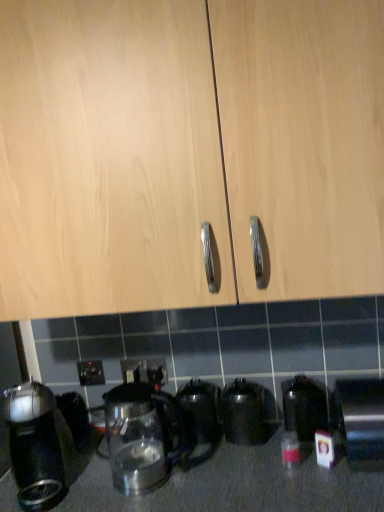
Question: Is point (84, 362) positioned closer to the camera than point (44, 385)?

Choices:
 (A) closer
 (B) farther

Answer: (A)

Question: In terms of width, does black plastic electric outlet at lower center, the third electric outlet viewed from the right, look wider or thinner when compared to black plastic coffee maker at left, acting as the 6th kitchen appliance starting from the right?

Choices:
 (A) wide
 (B) thin

Answer: (B)

Question: Which object is positioned closest to the translucent glass bottle at lower right?

Choices:
 (A) light wood cabinet at center
 (B) transparent glass kettle at center, which appears as the 4th kitchen appliance when viewed from the right
 (C) transparent glass kettle at lower center, the second kitchen appliance when ordered from left to right
 (D) black plastic electric outlet at lower center, which ranks as the first electric outlet in left-to-right order
 (E) transparent glass kettle at lower center, the second kitchen appliance when ordered from right to left

Answer: (E)

Question: Considering the real-world distances, which object is farthest from the black plastic coffee maker at left, positioned as the first kitchen appliance in left-to-right order?

Choices:
 (A) satin silver toaster at lower right, which is the 6th kitchen appliance from left to right
 (B) translucent glass bottle at lower right
 (C) transparent glass kettle at lower center, which is the 5th kitchen appliance from left to right
 (D) black metallic kettle at center, placed as the fourth kitchen appliance when sorted from left to right
 (E) light wood cabinet at center

Answer: (A)